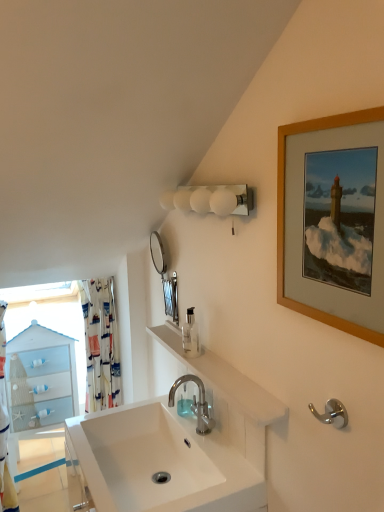
I want to click on free region under white frosted glass sconce at upper center (from a real-world perspective), so click(218, 362).